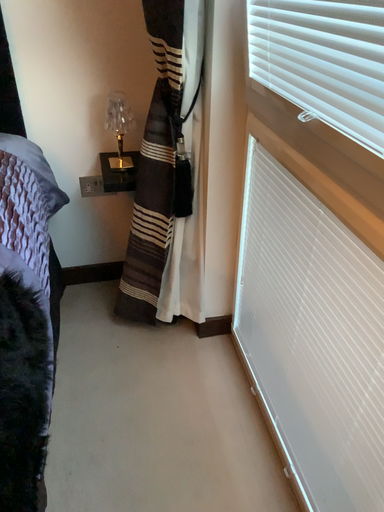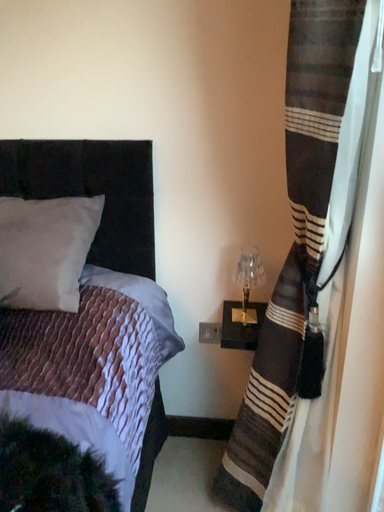
Question: Which way did the camera rotate in the video?

Choices:
 (A) rotated left
 (B) rotated right

Answer: (A)